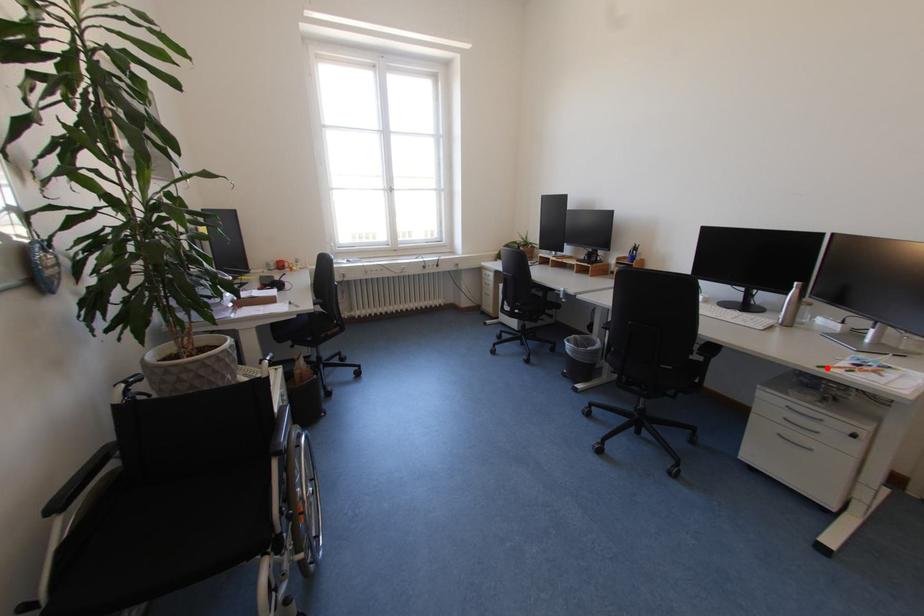
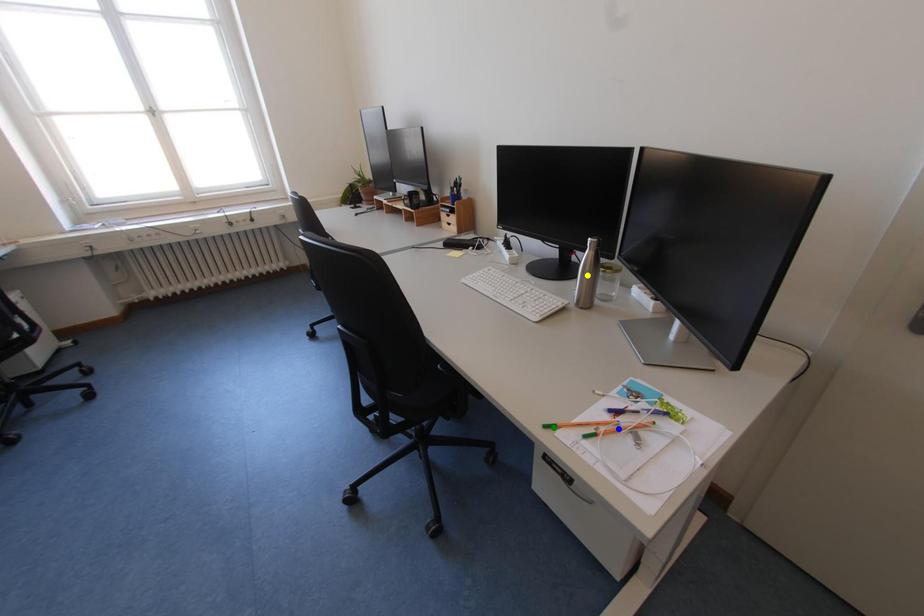
Question: I am providing you with two images of the same scene from different viewpoints. A red point is marked on the first image. You are given multiple points on the second image. In image 2, which mark is for the same physical point as the one in image 1?

Choices:
 (A) yellow point
 (B) blue point
 (C) green point

Answer: (C)